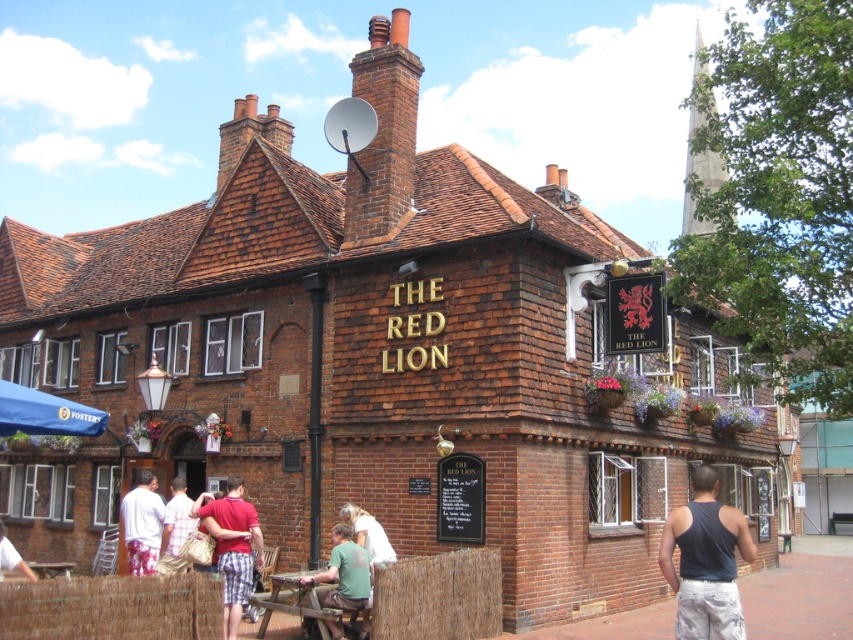
You are a customer standing outside the pub and looking at the entrance. You see a point at coordinate (x=343, y=572). What object is located at that point?

The point at coordinate (x=343, y=572) corresponds to the green cotton shirt at lower center.

You are standing in front of the pub and want to locate two specific points marked on the building. The first point is at coordinate point (697, 516) and the second is at point (345, 525). Which of these two points is closer to your current position?

Point (697, 516) is closer to the viewer than point (345, 525).

You are standing in front of the pub and want to find the dark blue tank top at center. According to the coordinates given, where would you look relative to the pub?

The dark blue tank top at center is located at coordinates point (705, 561), which is near the lower right corner of the pub.